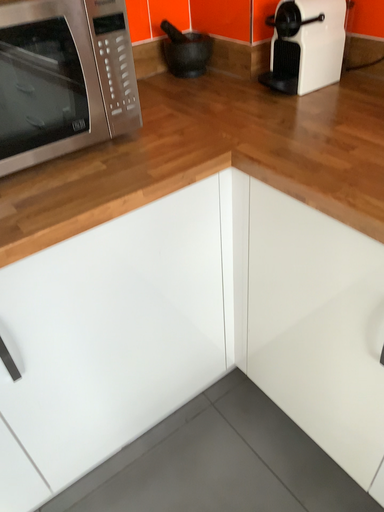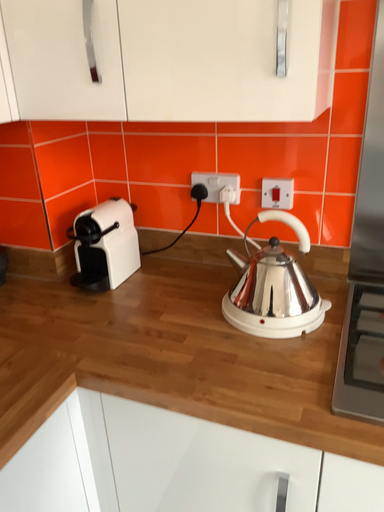
Question: How did the camera likely rotate when shooting the video?

Choices:
 (A) rotated downward
 (B) rotated upward

Answer: (B)